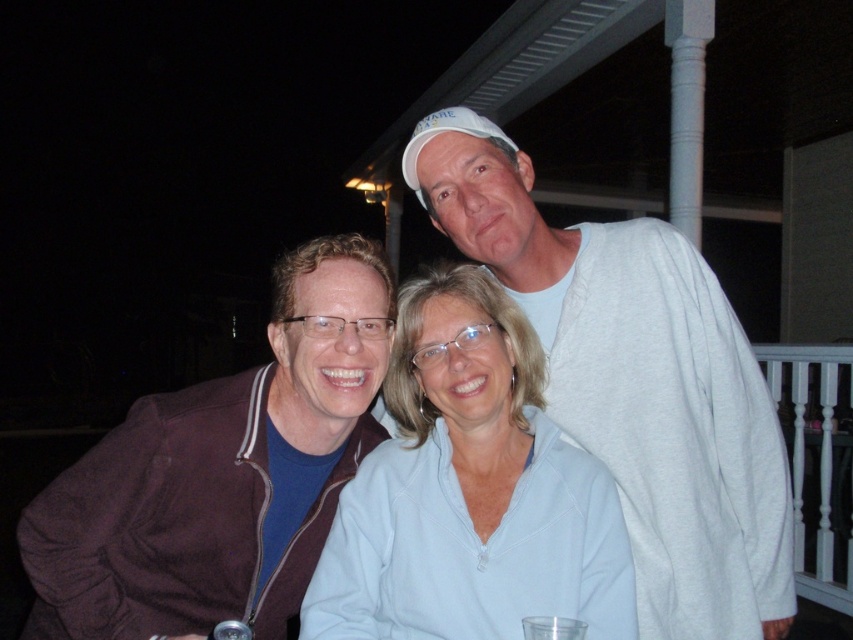
Is point (523, 189) less distant than point (380, 566)?

No, it is behind (380, 566).

Does white cotton shirt at upper right come behind light blue zip-up sweater at center?

Yes.

Is point (697, 580) more distant than point (486, 310)?

Yes, it is behind point (486, 310).

The height and width of the screenshot is (640, 853). I want to click on white cotton shirt at upper right, so click(x=635, y=381).

Consider the image. Who is higher up, brown fabric jacket at left or light blue zip-up sweater at center?

light blue zip-up sweater at center is higher up.

Does brown fabric jacket at left appear on the right side of light blue zip-up sweater at center?

No, brown fabric jacket at left is not to the right of light blue zip-up sweater at center.

This screenshot has width=853, height=640. I want to click on brown fabric jacket at left, so click(x=221, y=474).

Does point (691, 374) lie in front of point (93, 540)?

No, it is behind (93, 540).

From the picture: Is white cotton shirt at upper right positioned before brown fabric jacket at left?

No.

Is point (604, 232) closer to viewer compared to point (286, 582)?

No.

You are a GUI agent. You are given a task and a screenshot of the screen. Output one action in this format:
    pyautogui.click(x=<x>, y=<y>)
    Task: Click on the white cotton shirt at upper right
    
    Given the screenshot: What is the action you would take?
    635,381